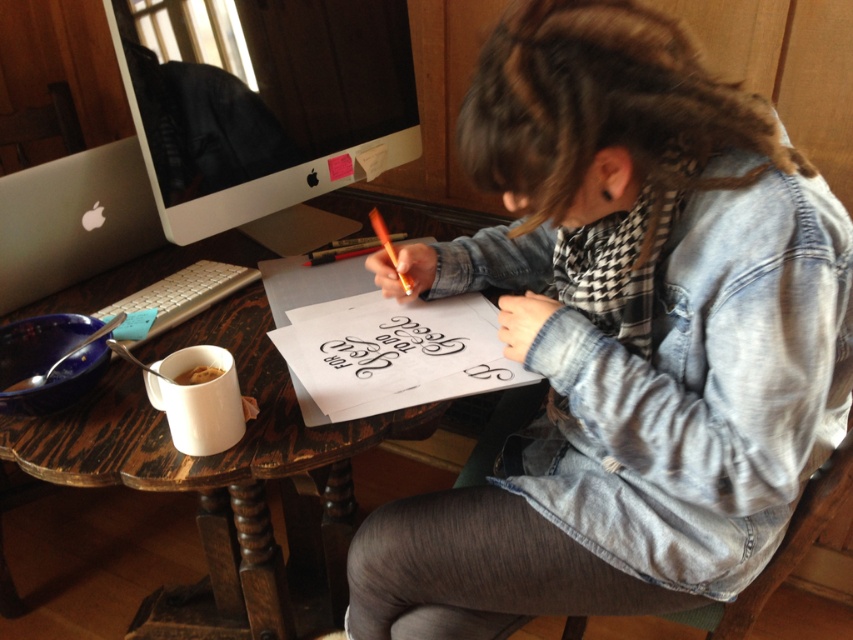
Question: Does denim jacket at center appear on the right side of wooden table at center?

Choices:
 (A) no
 (B) yes

Answer: (B)

Question: Which point is closer to the camera?

Choices:
 (A) black calligraphy at center
 (B) smooth orange crayon at center
 (C) white glossy computer monitor at upper left
 (D) wooden table at center

Answer: (D)

Question: Is denim jacket at center smaller than black calligraphy at center?

Choices:
 (A) no
 (B) yes

Answer: (A)

Question: Does denim jacket at center have a smaller size compared to white glossy computer monitor at upper left?

Choices:
 (A) no
 (B) yes

Answer: (A)

Question: Based on their relative distances, which object is nearer to the smooth orange crayon at center?

Choices:
 (A) white glossy computer monitor at upper left
 (B) wooden table at center

Answer: (A)

Question: Which of the following is the farthest from the observer?

Choices:
 (A) [448, 616]
 (B) [422, 349]
 (C) [305, 145]

Answer: (C)